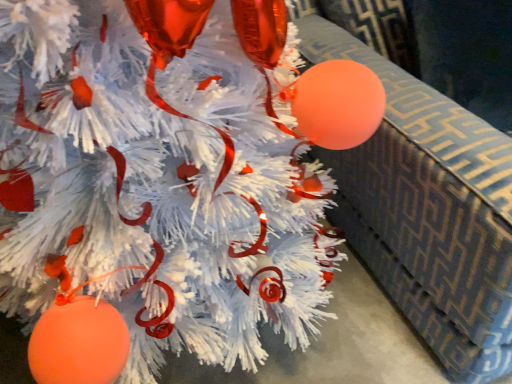
At what (x,y) coordinates should I click in order to perform the action: click on textured blue couch at upper right. Please return your answer as a coordinate pair (x, y). Image resolution: width=512 pixels, height=384 pixels. Looking at the image, I should click on (426, 209).

What do you see at coordinates (426, 209) in the screenshot?
I see `textured blue couch at upper right` at bounding box center [426, 209].

Measure the distance between textured blue couch at upper right and camera.

textured blue couch at upper right is 24.87 inches away from camera.

Where is `textured blue couch at upper right`? This screenshot has width=512, height=384. textured blue couch at upper right is located at coordinates (426, 209).